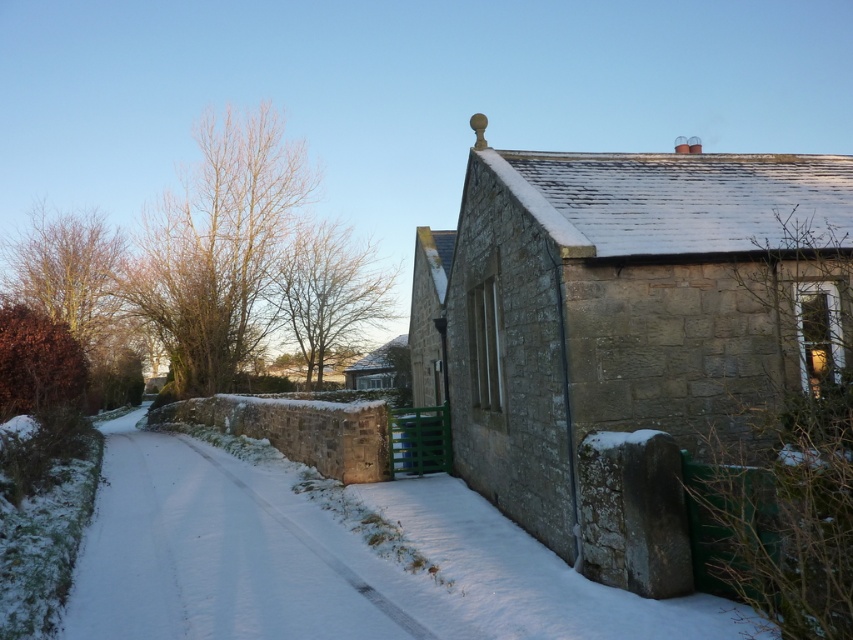
You are an architect evaluating the structural integrity of the stone house at right and the matte stone hut at center. Which structure has a higher risk of roof collapse due to snow accumulation?

The stone house at right has a greater height compared to the matte stone hut at center, which means it likely has a larger roof area and potentially more snow accumulation, increasing the risk of roof collapse.

You are standing at the point marked as point (625,310) in the winter scene. What structure is located at that point?

The point (625,310) corresponds to the stone house at right.